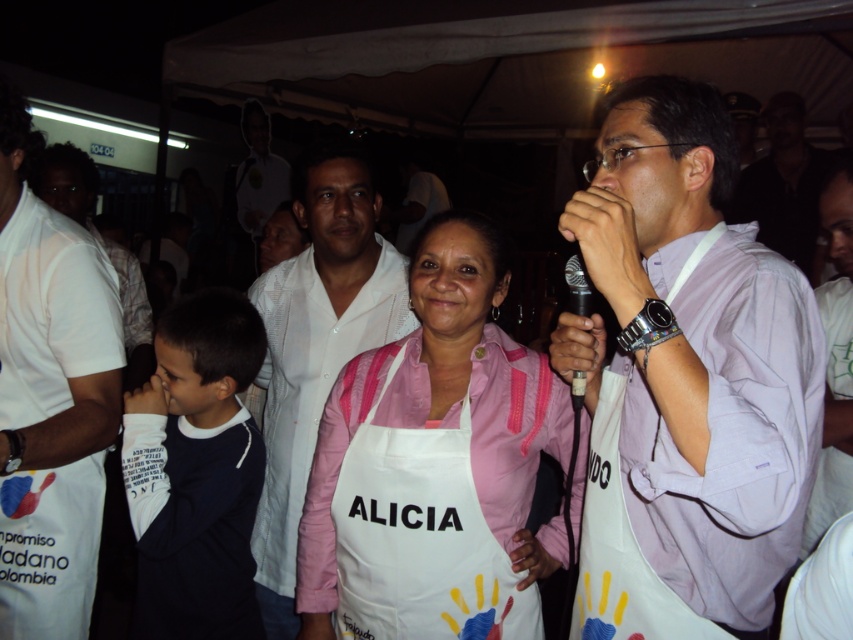
You are an event organizer checking the setup. You notice the white fabric apron at center and the white fabric shirt at left. Which one is closer to the front of the stage?

The white fabric apron at center is closer to the front of the stage because it is in front of the white fabric shirt at left.

You are organizing a costume party and need to decide which item of clothing to place on a 30 cm wide display stand. The items available are the white fabric apron at center and the white fabric shirt at left. Based on their sizes, which item would fit better on the stand?

The white fabric apron at center has a width less than the white fabric shirt at left, so it would fit better on the 30 cm wide display stand since it is narrower.